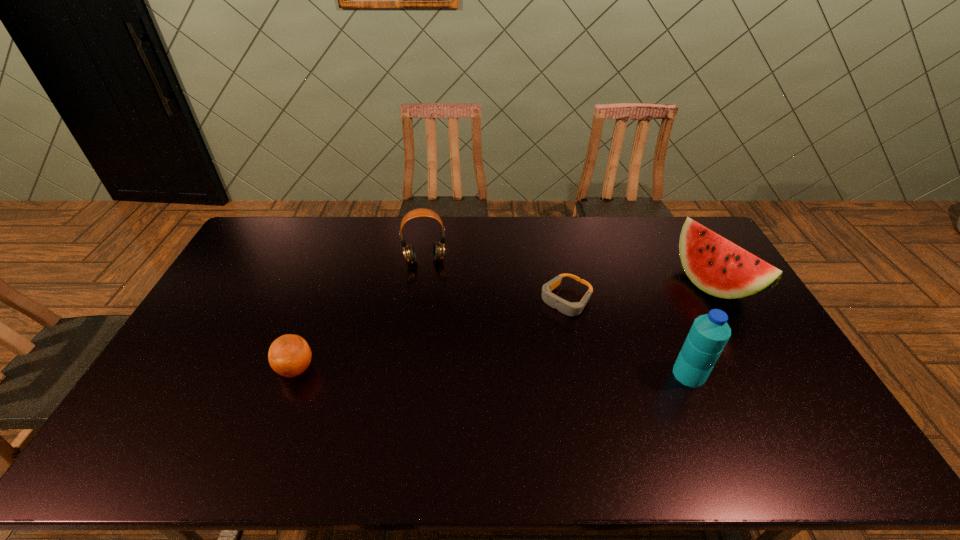
Identify the location of blank space located 0.180m on the ear cups of the second object from left to right. (431, 305).

At what (x,y) coordinates should I click in order to perform the action: click on vacant point located 0.280m on the ear cups of the second object from left to right. Please return your answer as a coordinate pair (x, y). The image size is (960, 540). Looking at the image, I should click on (434, 327).

Find the location of a particular element. Image resolution: width=960 pixels, height=540 pixels. free space located on the outer rind of the rightmost object is located at coordinates pos(614,345).

Find the location of a particular element. vacant position located on the outer rind of the rightmost object is located at coordinates (630, 338).

Where is `free location located 0.110m on the outer rind of the rightmost object`? The height and width of the screenshot is (540, 960). free location located 0.110m on the outer rind of the rightmost object is located at coordinates (674, 314).

Locate an element on the screen. vacant space located 0.260m on the front and back of the goggles is located at coordinates (x=501, y=366).

At what (x,y) coordinates should I click in order to perform the action: click on vacant space situated on the front and back of the goggles. Please return your answer as a coordinate pair (x, y). The width and height of the screenshot is (960, 540). Looking at the image, I should click on (515, 353).

Identify the location of vacant area situated 0.180m on the front and back of the goggles. (518, 349).

I want to click on headset that is at the far edge, so click(x=409, y=253).

This screenshot has width=960, height=540. I want to click on watermelon situated at the far edge, so coord(717,266).